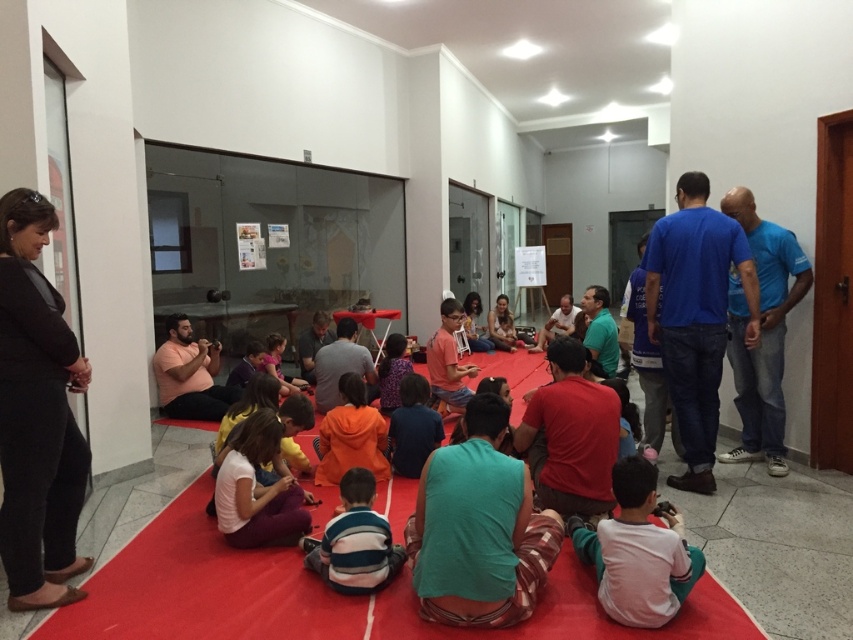
You are a photographer trying to capture a group photo of the blue cotton shirt at right and the striped cotton shirt at center. Based on their positions, which one should you focus on first to ensure both are in frame?

The striped cotton shirt at center is to the left of the blue cotton shirt at right. Focus on the striped cotton shirt at center first, then pan right to include the blue cotton shirt at right in the frame.